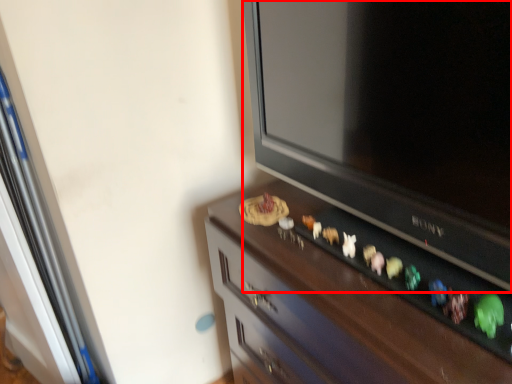
Question: Considering the relative positions of television (annotated by the red box) and furniture in the image provided, where is television (annotated by the red box) located with respect to the staircase?

Choices:
 (A) right
 (B) left

Answer: (B)